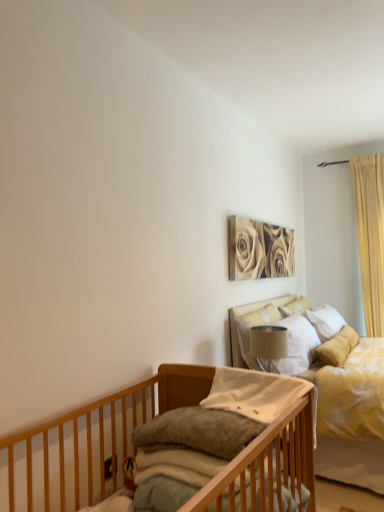
Question: Is yellow fabric curtain at right to the left of white soft pillow at upper right, which is the third pillow from left to right, from the viewer's perspective?

Choices:
 (A) no
 (B) yes

Answer: (A)

Question: Is yellow fabric curtain at right bigger than white soft pillow at upper right, the first pillow in the back-to-front sequence?

Choices:
 (A) yes
 (B) no

Answer: (A)

Question: From the image's perspective, is yellow fabric curtain at right beneath white soft pillow at upper right, which is the 3th pillow in front-to-back order?

Choices:
 (A) no
 (B) yes

Answer: (A)

Question: Is yellow fabric curtain at right looking in the opposite direction of white soft pillow at upper right, which is the 3th pillow in front-to-back order?

Choices:
 (A) yes
 (B) no

Answer: (B)

Question: Does yellow fabric curtain at right turn towards white soft pillow at upper right, marked as the 1th pillow in a right-to-left arrangement?

Choices:
 (A) no
 (B) yes

Answer: (A)

Question: Is yellow fabric curtain at right thinner than white soft pillow at upper right, the first pillow in the back-to-front sequence?

Choices:
 (A) no
 (B) yes

Answer: (A)

Question: From a real-world perspective, is soft gray fabric mattress at lower left physically above sepia-toned canvas at upper center?

Choices:
 (A) yes
 (B) no

Answer: (B)

Question: From a real-world perspective, is soft gray fabric mattress at lower left under sepia-toned canvas at upper center?

Choices:
 (A) no
 (B) yes

Answer: (B)

Question: Can you confirm if soft gray fabric mattress at lower left is smaller than sepia-toned canvas at upper center?

Choices:
 (A) no
 (B) yes

Answer: (B)

Question: Can you confirm if soft gray fabric mattress at lower left is positioned to the left of sepia-toned canvas at upper center?

Choices:
 (A) no
 (B) yes

Answer: (B)

Question: Is soft gray fabric mattress at lower left closer to the viewer compared to sepia-toned canvas at upper center?

Choices:
 (A) yes
 (B) no

Answer: (A)

Question: Can you confirm if soft gray fabric mattress at lower left is shorter than sepia-toned canvas at upper center?

Choices:
 (A) yes
 (B) no

Answer: (A)

Question: From the image's perspective, is white soft pillow at upper right, which is the 3th pillow in front-to-back order, over satin white pillow at upper center, which is counted as the second pillow, starting from the back?

Choices:
 (A) no
 (B) yes

Answer: (B)